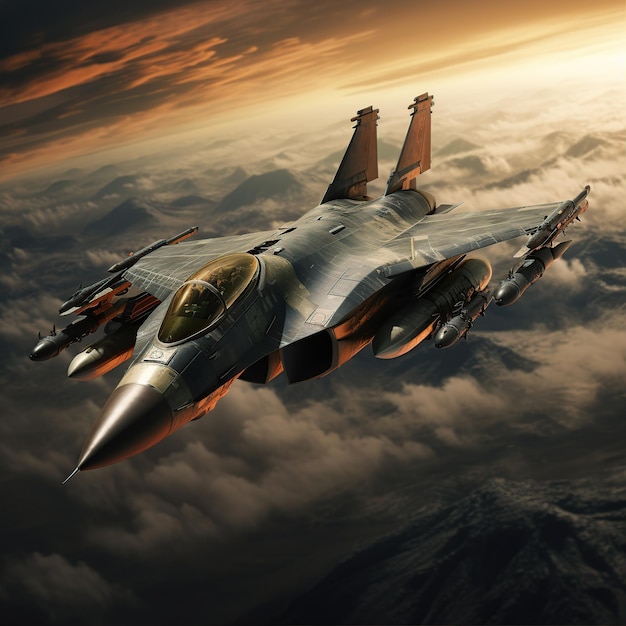
Where is `airplane cabin`? Image resolution: width=626 pixels, height=626 pixels. airplane cabin is located at coordinates (198, 304).